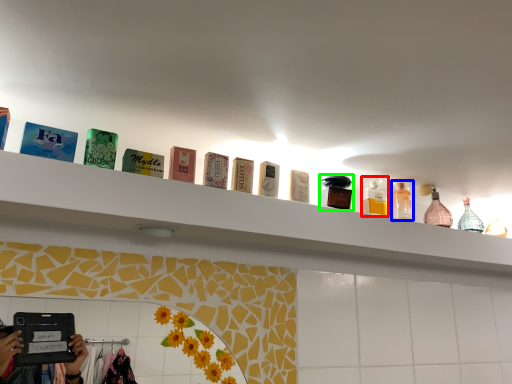
Question: Based on their relative distances, which object is farther from mouthwash (highlighted by a red box)? Choose from toiletry (highlighted by a blue box) and toiletry (highlighted by a green box).

Choices:
 (A) toiletry
 (B) toiletry

Answer: (B)